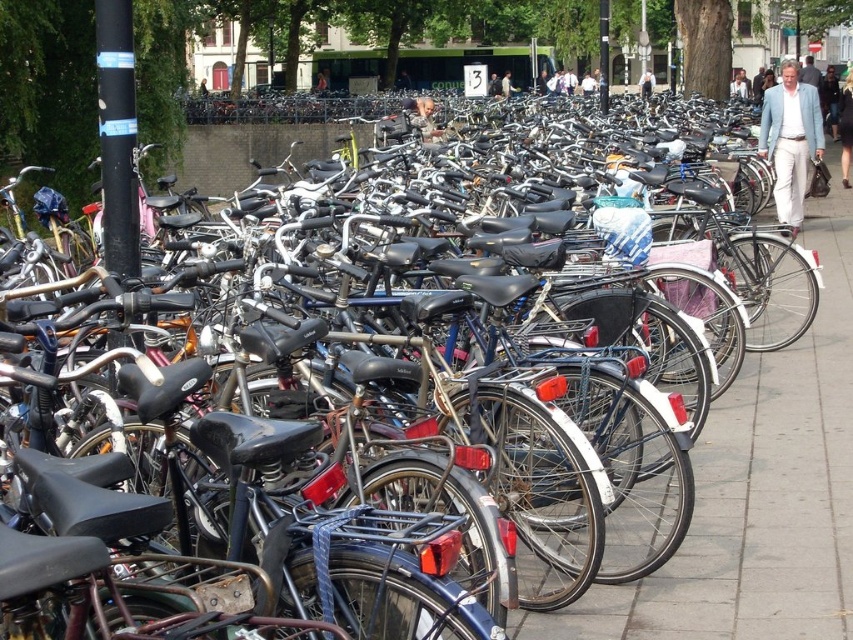
Consider the image. Can you confirm if smooth concrete pavement at center is shorter than light blue fabric jacket at center?

Indeed, smooth concrete pavement at center has a lesser height compared to light blue fabric jacket at center.

Which is in front, point (735, 611) or point (804, 180)?

Point (735, 611) is in front.

Does point (817, 605) come closer to viewer compared to point (791, 74)?

Yes, it is in front of point (791, 74).

You are a GUI agent. You are given a task and a screenshot of the screen. Output one action in this format:
    pyautogui.click(x=<x>, y=<y>)
    Task: Click on the smooth concrete pavement at center
    This screenshot has height=640, width=853.
    Given the screenshot: What is the action you would take?
    pyautogui.click(x=756, y=497)